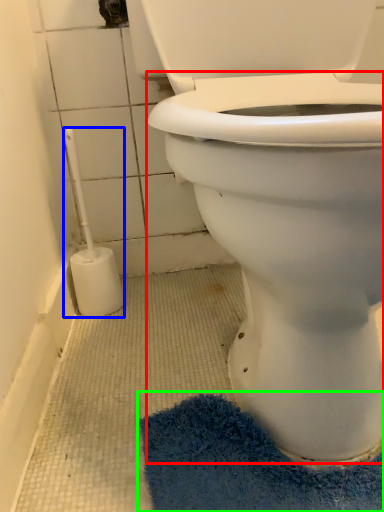
Question: Based on their relative distances, which object is nearer to bidet (highlighted by a red box)? Choose from brush (highlighted by a blue box) and bath mat (highlighted by a green box).

Choices:
 (A) brush
 (B) bath mat

Answer: (B)